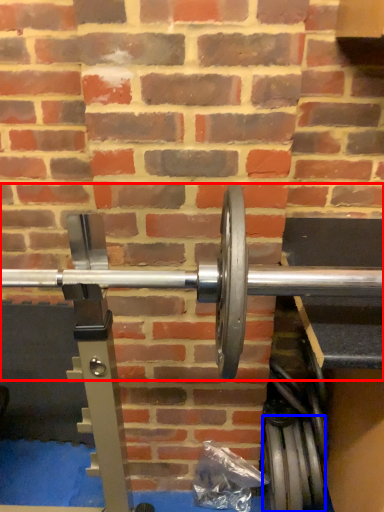
Question: Which point is further to the camera, dumbbell (highlighted by a red box) or tire (highlighted by a blue box)?

Choices:
 (A) dumbbell
 (B) tire

Answer: (B)